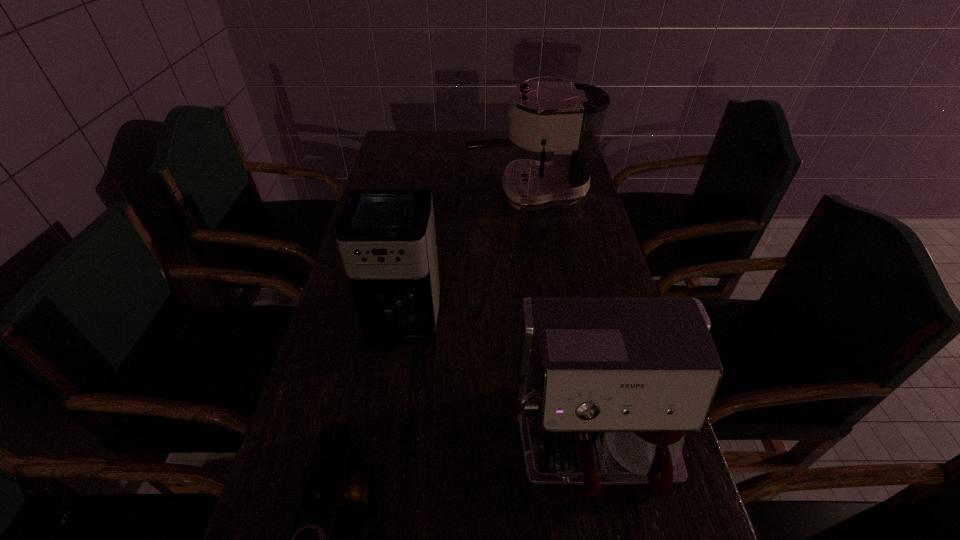
Identify the location of vacant area at the right edge. (547, 210).

Image resolution: width=960 pixels, height=540 pixels. In order to click on vacant point located between the farthest object and the leftmost coffee maker in this screenshot , I will do `click(466, 258)`.

Locate an element on the screen. This screenshot has height=540, width=960. empty space between the nearest coffee maker and the second farthest coffee maker is located at coordinates (x=497, y=385).

Identify the location of vacant area that lies between the second nearest coffee maker and the nearest coffee maker. (497, 385).

Find the location of `unoccupied position between the farthest coffee maker and the leftmost coffee maker`. unoccupied position between the farthest coffee maker and the leftmost coffee maker is located at coordinates (466, 258).

At what (x,y) coordinates should I click in order to perform the action: click on vacant space that's between the farthest object and the third nearest object. Please return your answer as a coordinate pair (x, y). Looking at the image, I should click on (466, 258).

You are a GUI agent. You are given a task and a screenshot of the screen. Output one action in this format:
    pyautogui.click(x=<x>, y=<y>)
    Task: Click on the vacant area between the nearest coffee maker and the second farthest coffee maker
    This screenshot has height=540, width=960.
    Given the screenshot: What is the action you would take?
    pyautogui.click(x=497, y=385)

Locate which object ranks second in proximity to the farthest object. Please provide its 2D coordinates. Your answer should be formatted as a tuple, i.e. [(x, y)], where the tuple contains the x and y coordinates of a point satisfying the conditions above.

[(605, 387)]

Select which object appears as the second closest to the farthest coffee maker. Please provide its 2D coordinates. Your answer should be formatted as a tuple, i.e. [(x, y)], where the tuple contains the x and y coordinates of a point satisfying the conditions above.

[(605, 387)]

Identify which coffee maker is located as the second nearest to the second farthest coffee maker. Please provide its 2D coordinates. Your answer should be formatted as a tuple, i.e. [(x, y)], where the tuple contains the x and y coordinates of a point satisfying the conditions above.

[(566, 119)]